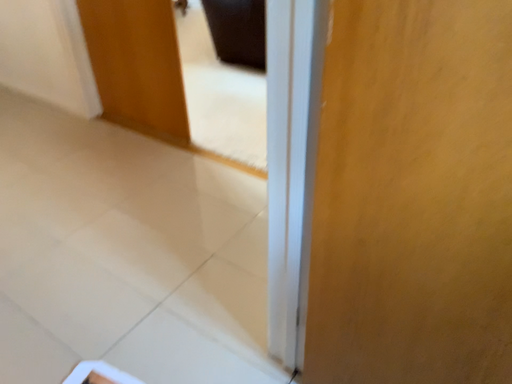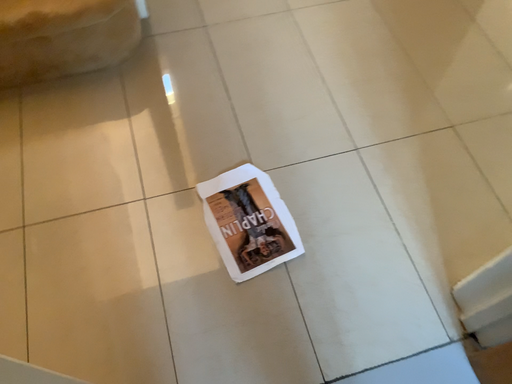
Question: Which way did the camera rotate in the video?

Choices:
 (A) rotated right
 (B) rotated left

Answer: (B)